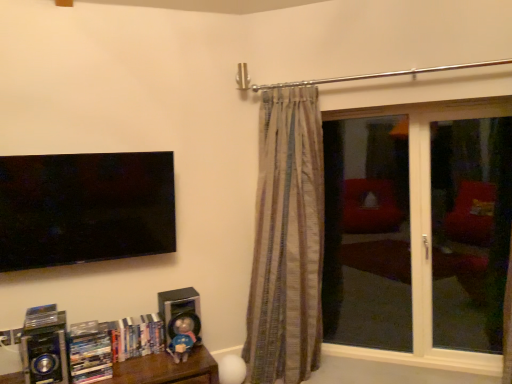
You are a GUI agent. You are given a task and a screenshot of the screen. Output one action in this format:
    pyautogui.click(x=<x>, y=<y>)
    Task: Click on the empty space that is ontop of metallic blue speaker at lower left, which is the 1th speaker from front to back (from a real-world perspective)
    The height and width of the screenshot is (384, 512).
    Given the screenshot: What is the action you would take?
    pyautogui.click(x=45, y=315)